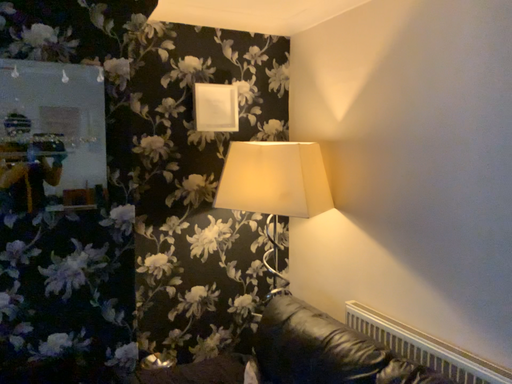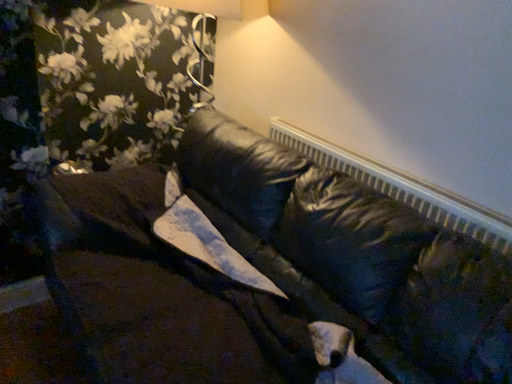
Question: How did the camera likely rotate when shooting the video?

Choices:
 (A) rotated left
 (B) rotated right

Answer: (B)